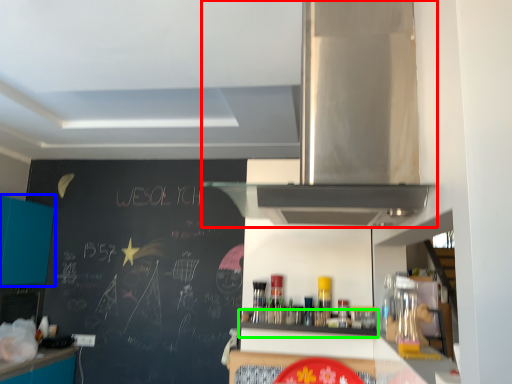
Question: Which object is positioned closest to home appliance (highlighted by a red box)? Select from cabinetry (highlighted by a blue box) and shelf (highlighted by a green box).

Choices:
 (A) cabinetry
 (B) shelf

Answer: (B)